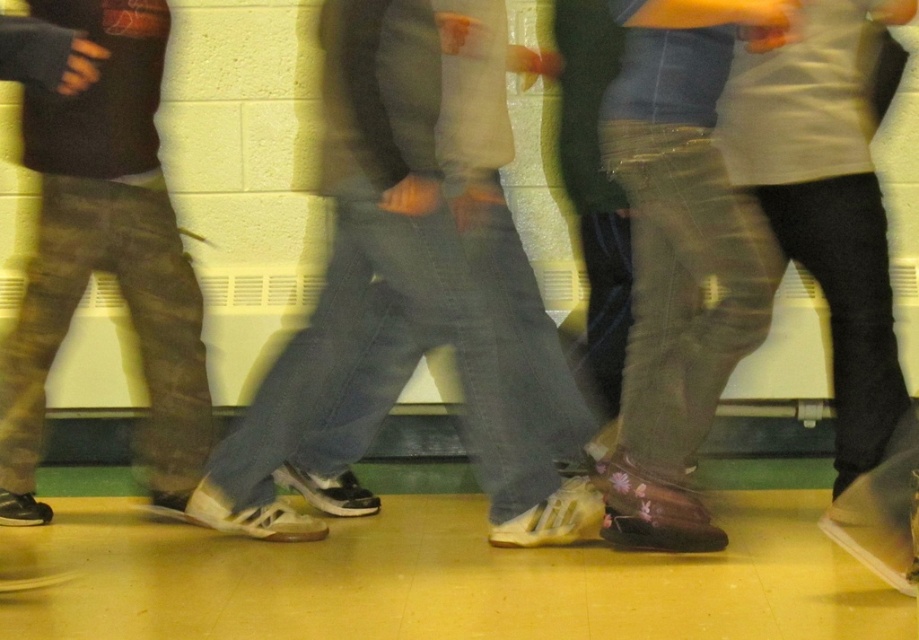
You are a photographer trying to capture the height difference between the white matte sneakers at center and the camouflage pants at left in the image. Based on the scene, which object appears taller?

The white matte sneakers at center appears taller than the camouflage pants at left according to the description.

You are a photographer trying to capture a clear shot of both the white matte sneakers at center and the floral leather boots at center in the hallway scene. Since the camera can only focus on one object at a time, which object should you choose to ensure the details are clearer given their sizes?

The white matte sneakers at center has a larger width than the floral leather boots at center, so focusing on the white matte sneakers at center would allow for clearer details due to its bigger size.

You are a photographer trying to capture the white matte sneakers at center and the floral leather boots at center in a clear photo. Since both are at the center, which one will be more visible in the photo due to their positioning?

The white matte sneakers at center is positioned over floral leather boots at center, so it will be more visible in the photo as it is in front.